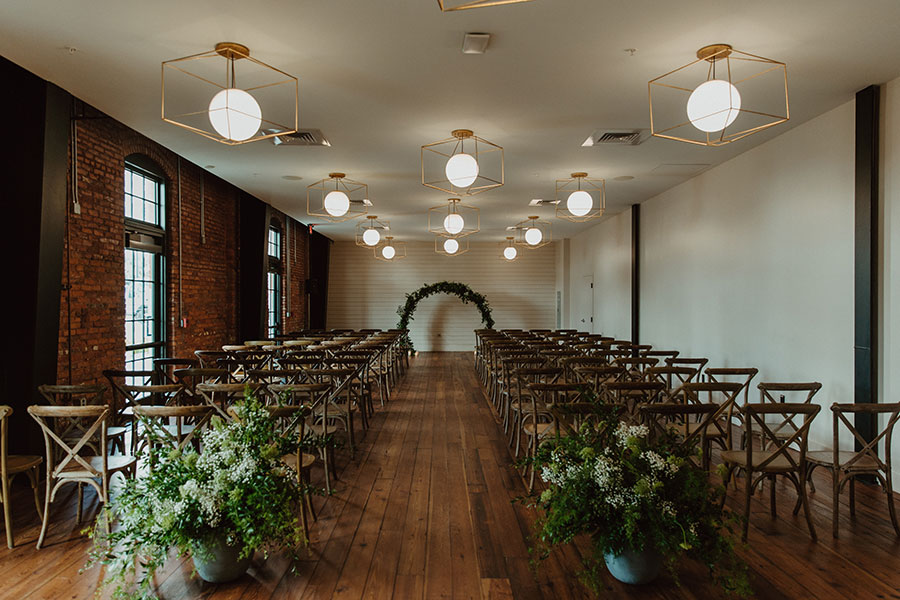
I want to click on flowerpot, so click(627, 569), click(221, 567).